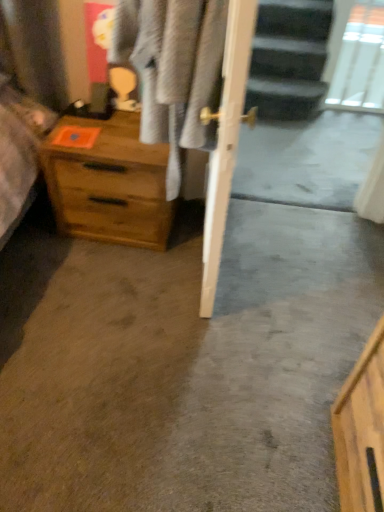
Question: From a real-world perspective, is wooden chest of drawers at left under transparent glass door at upper right?

Choices:
 (A) no
 (B) yes

Answer: (B)

Question: From the image's perspective, would you say wooden chest of drawers at left is positioned over transparent glass door at upper right?

Choices:
 (A) yes
 (B) no

Answer: (B)

Question: Is wooden chest of drawers at left surrounding transparent glass door at upper right?

Choices:
 (A) no
 (B) yes

Answer: (A)

Question: Considering the relative sizes of wooden chest of drawers at left and transparent glass door at upper right in the image provided, is wooden chest of drawers at left shorter than transparent glass door at upper right?

Choices:
 (A) no
 (B) yes

Answer: (B)

Question: Could you tell me if wooden chest of drawers at left is turned towards transparent glass door at upper right?

Choices:
 (A) no
 (B) yes

Answer: (A)

Question: From a real-world perspective, relative to wooden chest of drawers at left, is light gray fabric at center vertically above or below?

Choices:
 (A) below
 (B) above

Answer: (B)

Question: In terms of height, does light gray fabric at center look taller or shorter compared to wooden chest of drawers at left?

Choices:
 (A) short
 (B) tall

Answer: (B)

Question: From the image's perspective, relative to wooden chest of drawers at left, is light gray fabric at center above or below?

Choices:
 (A) below
 (B) above

Answer: (B)

Question: Looking at the image, does light gray fabric at center seem bigger or smaller compared to wooden chest of drawers at left?

Choices:
 (A) big
 (B) small

Answer: (A)

Question: Is point (362, 57) closer or farther from the camera than point (115, 146)?

Choices:
 (A) farther
 (B) closer

Answer: (A)

Question: From a real-world perspective, is transparent glass door at upper right positioned above or below wooden chest of drawers at left?

Choices:
 (A) above
 (B) below

Answer: (A)

Question: Looking at their shapes, would you say transparent glass door at upper right is wider or thinner than wooden chest of drawers at left?

Choices:
 (A) wide
 (B) thin

Answer: (B)

Question: From the image's perspective, relative to wooden chest of drawers at left, is transparent glass door at upper right above or below?

Choices:
 (A) below
 (B) above

Answer: (B)

Question: Considering their positions, is transparent glass door at upper right located in front of or behind light gray fabric at center?

Choices:
 (A) front
 (B) behind

Answer: (B)

Question: Looking at their shapes, would you say transparent glass door at upper right is wider or thinner than light gray fabric at center?

Choices:
 (A) thin
 (B) wide

Answer: (A)